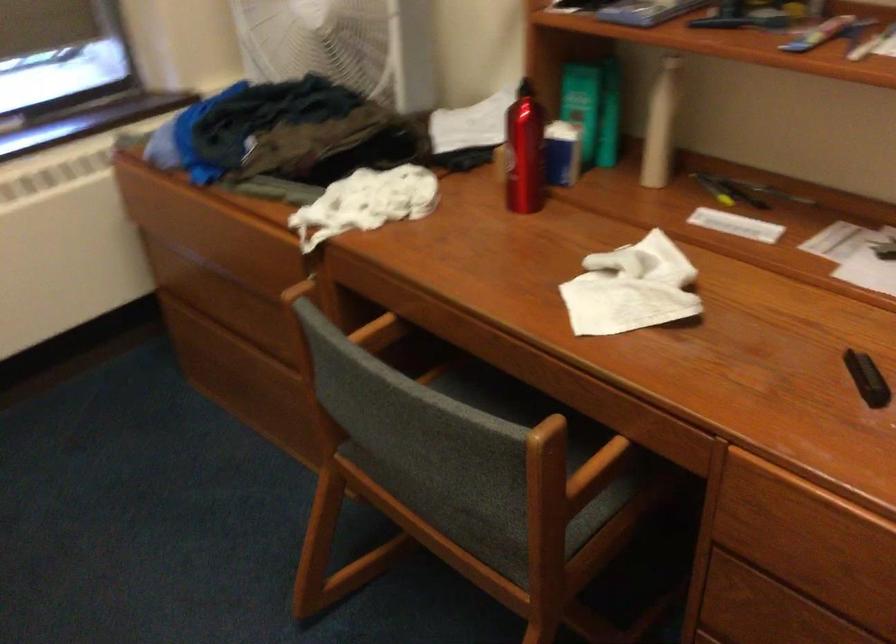
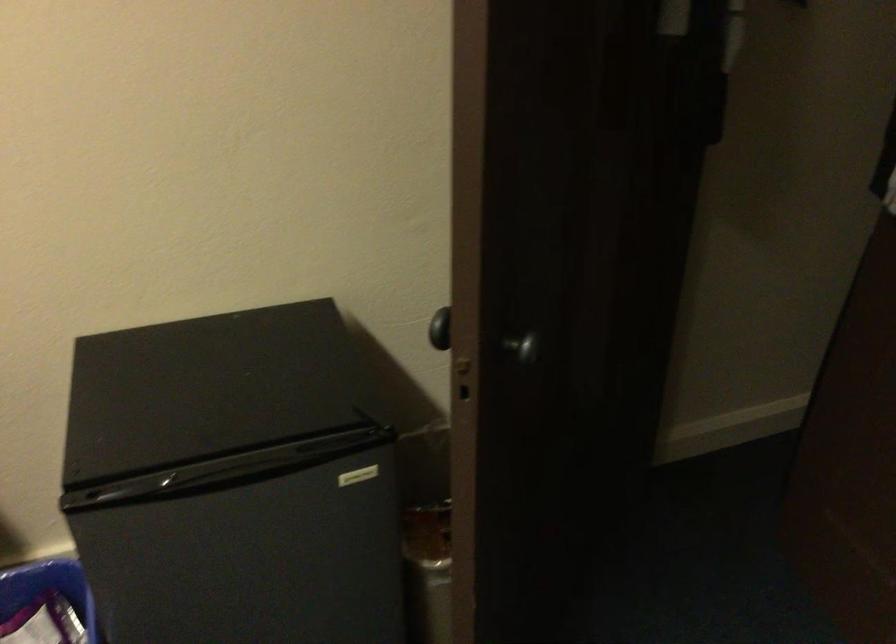
Question: The first image is from the beginning of the video and the second image is from the end. How did the camera likely rotate when shooting the video?

Choices:
 (A) Left
 (B) Right
 (C) Up
 (D) Down

Answer: (B)